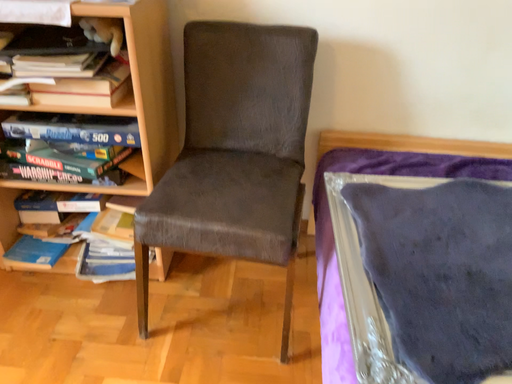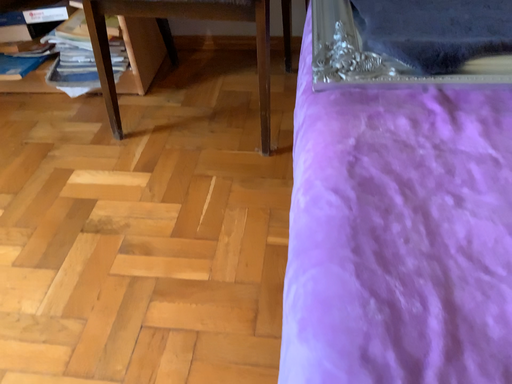
Question: How did the camera likely rotate when shooting the video?

Choices:
 (A) rotated downward
 (B) rotated upward

Answer: (A)